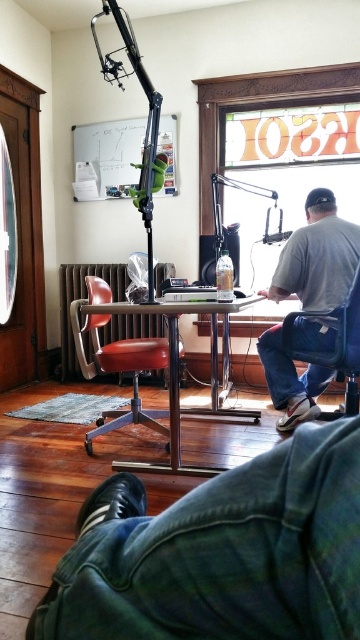
You are standing in the room and want to place a new lamp on the metallic silver table at center. Based on the coordinates provided, can you confirm if the table is positioned in the center of the room?

The metallic silver table at center is located at coordinates point (178,376), which is close to the center of the room, so yes, it is positioned centrally.